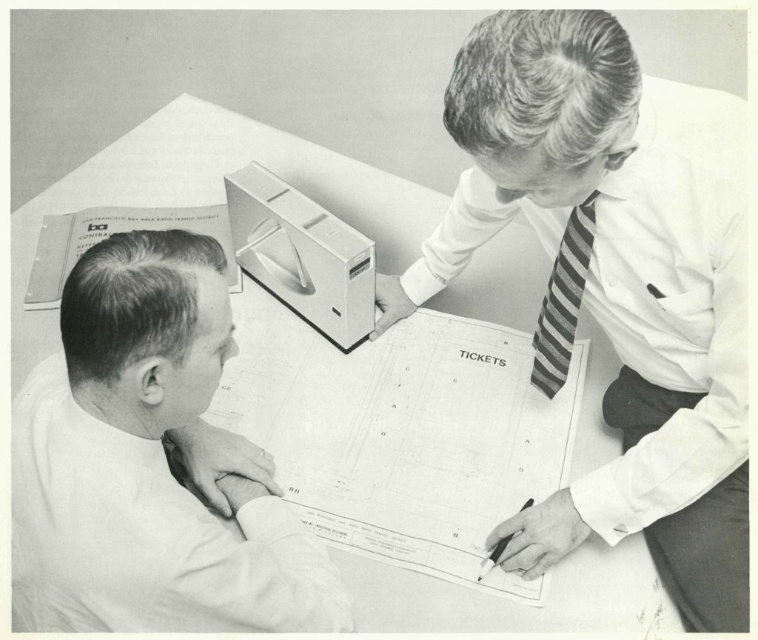
You are an observer standing at the edge of the table. Which object, the smooth white shirt at lower left or the striped fabric tie at upper right, is wider?

The smooth white shirt at lower left is wider than the striped fabric tie at upper right.

Based on the scene described, where exactly is the white paper at upper center located in the image?

The white paper at upper center is located at point coordinates of 0.302 on the x axis and 0.277 on the y axis.

You are a new employee attending a meeting at the table. You need to sign a document using the black plastic pen at lower center. Where should you place your hand to reach the pen while keeping your eyes on the white paper at upper center?

You should place your hand near the lower center of the table to reach the black plastic pen at lower center while keeping your eyes on the white paper at upper center.